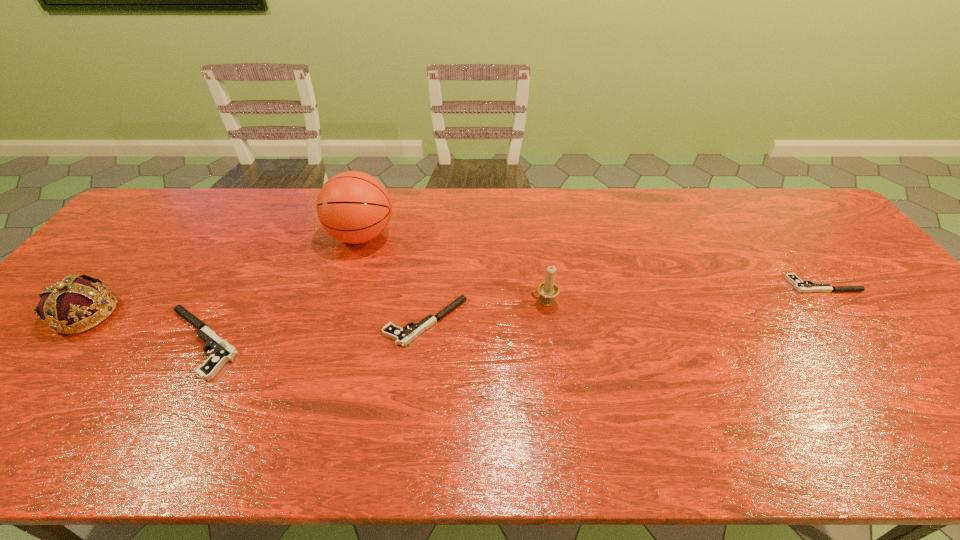
Identify which object is located as the nearest to the third object from right to left. Please provide its 2D coordinates. Your answer should be formatted as a tuple, i.e. [(x, y)], where the tuple contains the x and y coordinates of a point satisfying the conditions above.

[(354, 207)]

Locate an element on the screen. The height and width of the screenshot is (540, 960). object that is the fifth closest to the fifth object from right to left is located at coordinates (801, 286).

Where is `pistol object that ranks as the closest to the fourth object from right to left`? The height and width of the screenshot is (540, 960). pistol object that ranks as the closest to the fourth object from right to left is located at coordinates (402, 337).

Select which pistol is the second closest to the second pistol from right to left. Please provide its 2D coordinates. Your answer should be formatted as a tuple, i.e. [(x, y)], where the tuple contains the x and y coordinates of a point satisfying the conditions above.

[(801, 286)]

Find the location of `blank area in the image that satisfies the following two spatial constraints: 1. on the back side of the crown; 2. on the left side of the tallest object`. blank area in the image that satisfies the following two spatial constraints: 1. on the back side of the crown; 2. on the left side of the tallest object is located at coordinates (151, 235).